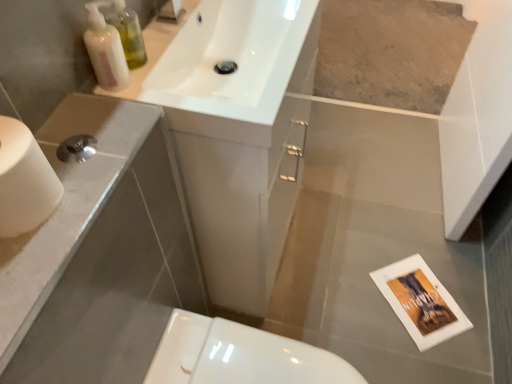
What do you see at coordinates (24, 180) in the screenshot? I see `white matte toilet paper at left` at bounding box center [24, 180].

Describe the element at coordinates (105, 49) in the screenshot. The image size is (512, 384). I see `white glossy soap dispenser at upper left` at that location.

What do you see at coordinates (229, 58) in the screenshot?
I see `white glossy sink at upper center` at bounding box center [229, 58].

In order to face white glossy toilet at lower center, should I rotate leftwards or rightwards?

Turn right by 2.815 degrees to look at white glossy toilet at lower center.

Find the location of a particular element. The width and height of the screenshot is (512, 384). white matte toilet paper at left is located at coordinates (24, 180).

Between white glossy sink at upper center and white glossy toilet at lower center, which one has less height?

Standing shorter between the two is white glossy sink at upper center.

Which is in front, point (301, 63) or point (362, 381)?

The point (362, 381) is closer to the camera.

Based on their sizes in the image, would you say white glossy sink at upper center is bigger or smaller than white glossy toilet at lower center?

In the image, white glossy sink at upper center appears to be larger than white glossy toilet at lower center.

Is white glossy sink at upper center far away from white glossy toilet at lower center?

Actually, white glossy sink at upper center and white glossy toilet at lower center are a little close together.

Consider the image. Relative to white glossy soap dispenser at upper left, is white glossy toilet at lower center in front or behind?

white glossy toilet at lower center is positioned farther from the viewer than white glossy soap dispenser at upper left.

Does white glossy toilet at lower center turn towards white glossy soap dispenser at upper left?

No.

Does white glossy toilet at lower center have a larger size compared to white glossy soap dispenser at upper left?

Indeed, white glossy toilet at lower center has a larger size compared to white glossy soap dispenser at upper left.

The image size is (512, 384). Identify the location of soap dispenser in front of the white glossy toilet at lower center. (105, 49).

From the image's perspective, does white glossy toilet at lower center appear lower than white glossy sink at upper center?

Yes, from the image's perspective, white glossy toilet at lower center is beneath white glossy sink at upper center.

Does white glossy toilet at lower center touch white glossy sink at upper center?

white glossy toilet at lower center and white glossy sink at upper center are not in contact.

Is white glossy toilet at lower center located outside white glossy sink at upper center?

Yes, white glossy toilet at lower center is outside of white glossy sink at upper center.

Between white glossy sink at upper center and translucent plastic bottles at upper left, which one has smaller width?

translucent plastic bottles at upper left.

Considering the positions of objects white glossy sink at upper center and translucent plastic bottles at upper left in the image provided, who is more to the right, white glossy sink at upper center or translucent plastic bottles at upper left?

white glossy sink at upper center.

Can you see white glossy sink at upper center touching translucent plastic bottles at upper left?

white glossy sink at upper center is not next to translucent plastic bottles at upper left, and they're not touching.

In the image, is white glossy sink at upper center on the left side or the right side of white matte toilet paper at left?

Based on their positions, white glossy sink at upper center is located to the right of white matte toilet paper at left.

From the image's perspective, is white glossy sink at upper center above or below white matte toilet paper at left?

white glossy sink at upper center is situated higher than white matte toilet paper at left in the image.

Does point (207, 105) come behind point (10, 127)?

Yes, point (207, 105) is farther from viewer.

Identify the location of sink above the white matte toilet paper at left (from the image's perspective). pos(229,58).

Can you tell me how much translucent plastic bottles at upper left and white matte toilet paper at left differ in facing direction?

translucent plastic bottles at upper left and white matte toilet paper at left are facing 6.1 degrees away from each other.

In terms of size, does translucent plastic bottles at upper left appear bigger or smaller than white matte toilet paper at left?

Considering their sizes, translucent plastic bottles at upper left takes up less space than white matte toilet paper at left.

Is the position of translucent plastic bottles at upper left less distant than that of white matte toilet paper at left?

No, the depth of translucent plastic bottles at upper left is greater than that of white matte toilet paper at left.

At what (x,y) coordinates should I click in order to perform the action: click on toiletry that is above the white matte toilet paper at left (from the image's perspective). Please return your answer as a coordinate pair (x, y). Looking at the image, I should click on click(x=128, y=32).

Does point (102, 24) appear closer or farther from the camera than point (286, 31)?

Clearly, point (102, 24) is closer to the camera than point (286, 31).

Considering the relative positions of white glossy soap dispenser at upper left and white glossy sink at upper center in the image provided, is white glossy soap dispenser at upper left in front of white glossy sink at upper center?

That is False.

The width and height of the screenshot is (512, 384). In order to click on sink that appears above the white glossy soap dispenser at upper left (from the image's perspective) in this screenshot , I will do `click(229, 58)`.

From the image's perspective, which one is positioned higher, white glossy soap dispenser at upper left or white glossy sink at upper center?

white glossy sink at upper center.

Locate an element on the screen. toilet below the white glossy sink at upper center (from the image's perspective) is located at coordinates (240, 355).

Image resolution: width=512 pixels, height=384 pixels. I want to click on toilet beneath the white glossy soap dispenser at upper left (from a real-world perspective), so click(x=240, y=355).

When comparing their distances from white glossy soap dispenser at upper left, does translucent plastic bottles at upper left or white glossy sink at upper center seem further?

white glossy sink at upper center is positioned further to the anchor white glossy soap dispenser at upper left.

Looking at the image, which one is located further to white matte toilet paper at left, white glossy soap dispenser at upper left or translucent plastic bottles at upper left?

translucent plastic bottles at upper left is further to white matte toilet paper at left.

Looking at the image, which one is located closer to white glossy soap dispenser at upper left, translucent plastic bottles at upper left or white glossy toilet at lower center?

Among the two, translucent plastic bottles at upper left is located nearer to white glossy soap dispenser at upper left.

When comparing their distances from white glossy soap dispenser at upper left, does white glossy sink at upper center or translucent plastic bottles at upper left seem further?

Among the two, white glossy sink at upper center is located further to white glossy soap dispenser at upper left.

Considering their positions, is white glossy sink at upper center positioned further to white matte toilet paper at left than white glossy toilet at lower center?

Among the two, white glossy toilet at lower center is located further to white matte toilet paper at left.

From the image, which object appears to be nearer to translucent plastic bottles at upper left, white glossy sink at upper center or white matte toilet paper at left?

The object closer to translucent plastic bottles at upper left is white glossy sink at upper center.

In the scene shown: From the image, which object appears to be nearer to white matte toilet paper at left, white glossy sink at upper center or translucent plastic bottles at upper left?

Among the two, translucent plastic bottles at upper left is located nearer to white matte toilet paper at left.

When comparing their distances from white glossy soap dispenser at upper left, does white glossy sink at upper center or white matte toilet paper at left seem further?

Based on the image, white matte toilet paper at left appears to be further to white glossy soap dispenser at upper left.

Where is `toilet paper that lies between white glossy sink at upper center and white glossy toilet at lower center from top to bottom`? The width and height of the screenshot is (512, 384). toilet paper that lies between white glossy sink at upper center and white glossy toilet at lower center from top to bottom is located at coordinates (24, 180).

Locate an element on the screen. This screenshot has width=512, height=384. toiletry located between white glossy soap dispenser at upper left and white glossy sink at upper center in the left-right direction is located at coordinates (128, 32).

At what (x,y) coordinates should I click in order to perform the action: click on soap dispenser between white glossy sink at upper center and white glossy toilet at lower center in the up-down direction. Please return your answer as a coordinate pair (x, y). Image resolution: width=512 pixels, height=384 pixels. Looking at the image, I should click on (105, 49).

The height and width of the screenshot is (384, 512). Identify the location of soap dispenser between translucent plastic bottles at upper left and white glossy toilet at lower center in the vertical direction. (105, 49).